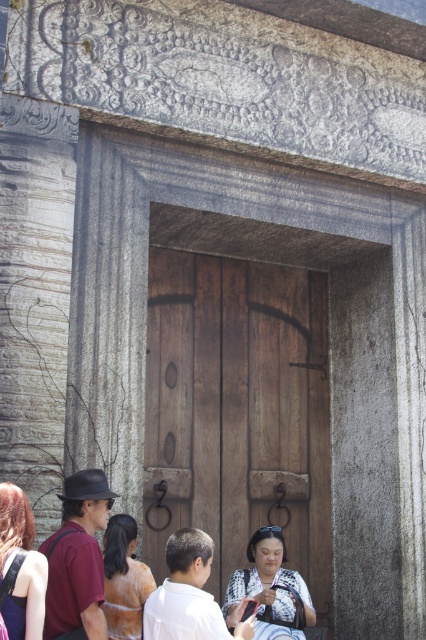
Between matte black hair at lower left and matte orange dress at center, which one appears on the right side from the viewer's perspective?

matte orange dress at center

Does matte black hair at lower left have a larger size compared to matte orange dress at center?

Indeed, matte black hair at lower left has a larger size compared to matte orange dress at center.

Is point (14, 637) behind point (143, 602)?

No, (14, 637) is in front of (143, 602).

Where is `matte black hair at lower left`? matte black hair at lower left is located at coordinates (20, 566).

Who is shorter, wooden door at center or matte black hair at lower left?

wooden door at center is shorter.

Is point (196, 483) behind point (8, 506)?

Yes.

The image size is (426, 640). In order to click on wooden door at center in this screenshot , I will do `click(238, 412)`.

Who is more distant from viewer, (158, 392) or (63, 586)?

Point (158, 392)

What are the coordinates of `wooden door at center` in the screenshot? It's located at (238, 412).